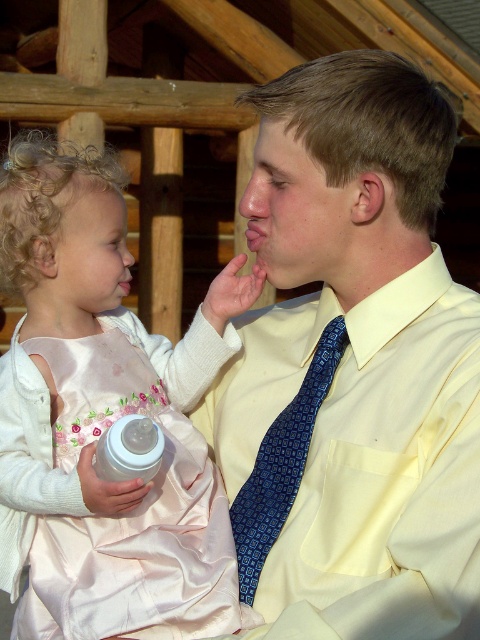
You are a photographer standing in front of the scene. You want to take a photo focusing on the yellow smooth shirt at center and the pink satin dress at center. Which one will appear larger in the photo?

The yellow smooth shirt at center will appear larger in the photo because it is closer to the viewer than the pink satin dress at center.

Looking at this image, looking at the image, which clothing item, the yellow smooth shirt at center or the pink satin dress at center, takes up more space in the scene?

The yellow smooth shirt at center is bigger than the pink satin dress at center, so it takes up more space in the scene.